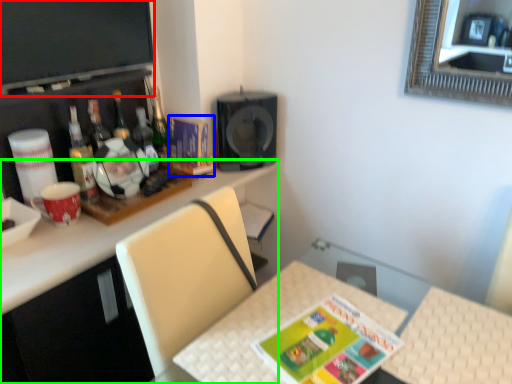
Question: Which object is positioned closest to television (highlighted by a red box)? Select from magazine (highlighted by a blue box) and desk (highlighted by a green box).

Choices:
 (A) magazine
 (B) desk

Answer: (A)